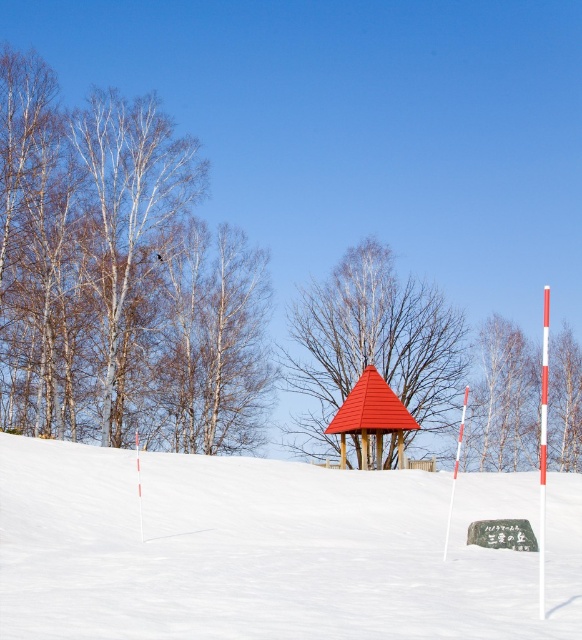
Question: Which point appears farthest from the camera in this image?

Choices:
 (A) (495, 412)
 (B) (178, 310)
 (C) (395, 400)

Answer: (A)

Question: Can you confirm if smooth wooden gazebo at center is smaller than red corrugated metal gazebo at center?

Choices:
 (A) no
 (B) yes

Answer: (A)

Question: Which point is closer to the camera?

Choices:
 (A) (365, 355)
 (B) (566, 339)
 (C) (519, 611)
 (D) (400, 424)

Answer: (C)

Question: Which point is closer to the camera?

Choices:
 (A) (484, 360)
 (B) (365, 308)

Answer: (B)

Question: Is smooth wooden gazebo at center bigger than bare birch tree at center?

Choices:
 (A) yes
 (B) no

Answer: (A)

Question: Is white snow at center positioned behind white bark trees at left?

Choices:
 (A) yes
 (B) no

Answer: (B)